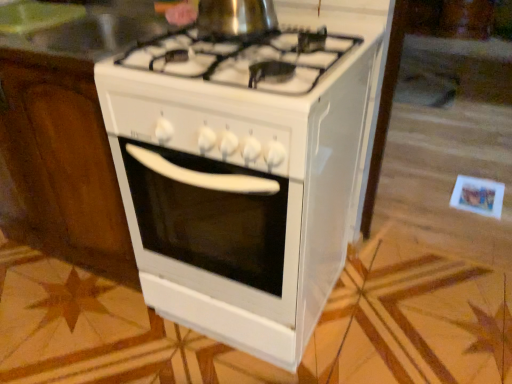
Find the location of `vacant space to the right of white glossy oven at center`. vacant space to the right of white glossy oven at center is located at coordinates (401, 309).